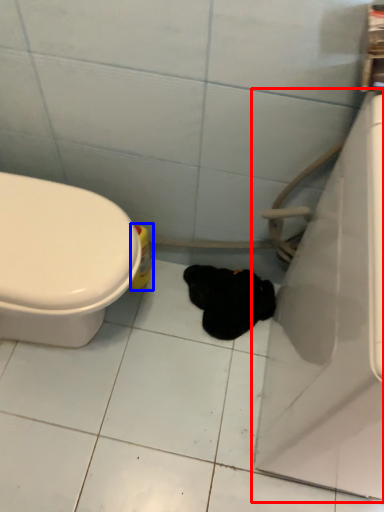
Question: Which object appears farthest to the camera in this image, bath (highlighted by a red box) or cleaning product (highlighted by a blue box)?

Choices:
 (A) bath
 (B) cleaning product

Answer: (B)